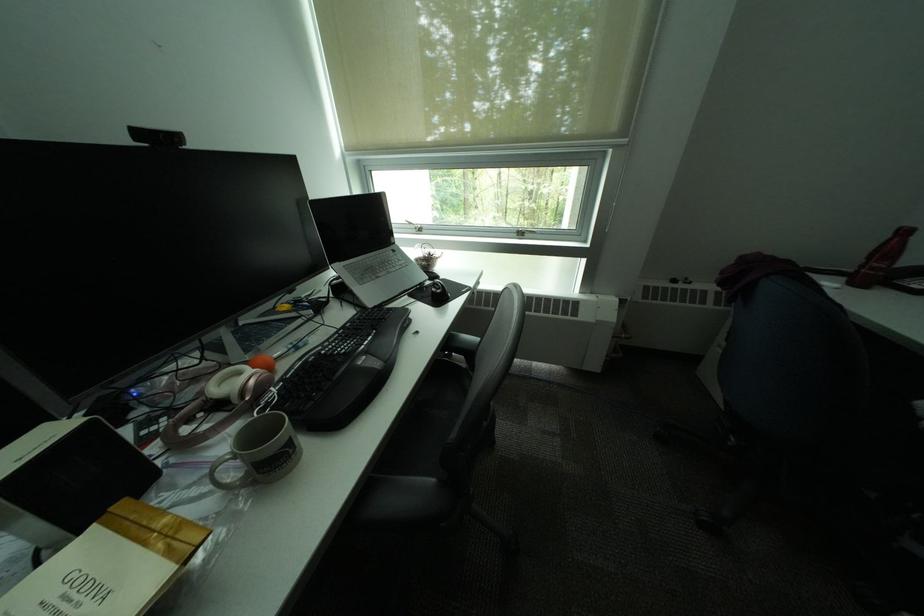
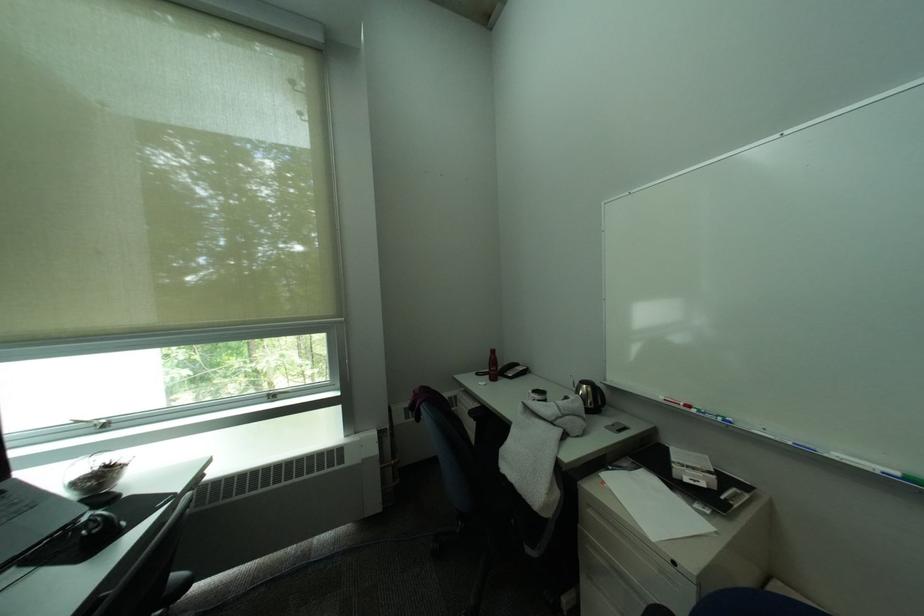
How did the camera likely rotate?

The camera rotated toward right-up.